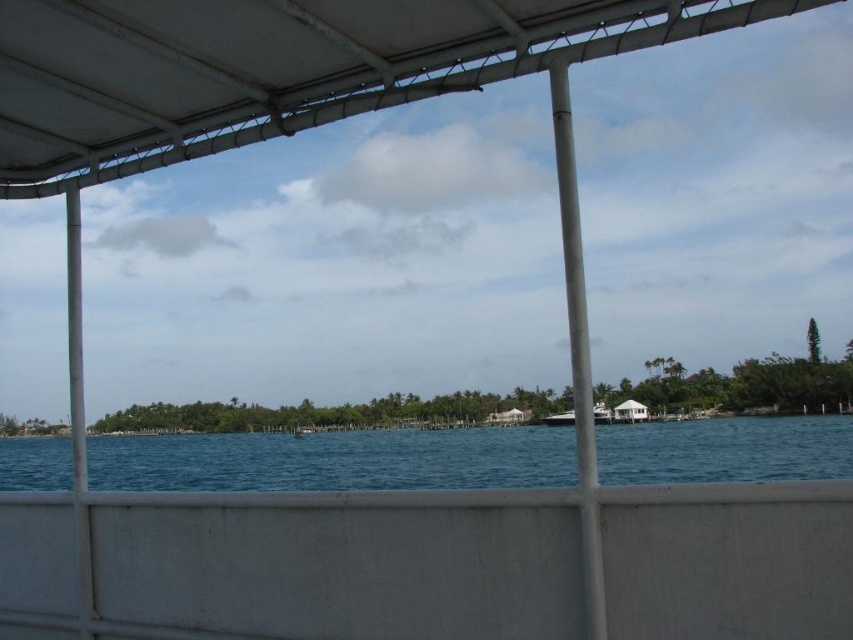
Does blue water at center have a lesser width compared to white glossy boat at center?

No, blue water at center is not thinner than white glossy boat at center.

Is blue water at center wider than white glossy boat at center?

Yes, blue water at center is wider than white glossy boat at center.

Which is in front, point (645, 429) or point (564, 412)?

Point (564, 412) is in front.

This screenshot has width=853, height=640. Find the location of `blue water at center`. blue water at center is located at coordinates (335, 460).

Is white matte canopy at upper center thinner than blue water at center?

Correct, white matte canopy at upper center's width is less than blue water at center's.

Does white matte canopy at upper center appear under blue water at center?

No, white matte canopy at upper center is not below blue water at center.

Image resolution: width=853 pixels, height=640 pixels. I want to click on white matte canopy at upper center, so click(x=280, y=67).

Locate an element on the screen. The image size is (853, 640). white matte canopy at upper center is located at coordinates (280, 67).

Who is shorter, white matte canopy at upper center or white glossy boat at center?

With less height is white matte canopy at upper center.

Locate an element on the screen. This screenshot has height=640, width=853. white matte canopy at upper center is located at coordinates (280, 67).

What do you see at coordinates (280, 67) in the screenshot?
I see `white matte canopy at upper center` at bounding box center [280, 67].

Find the location of a particular element. This screenshot has height=640, width=853. white matte canopy at upper center is located at coordinates (280, 67).